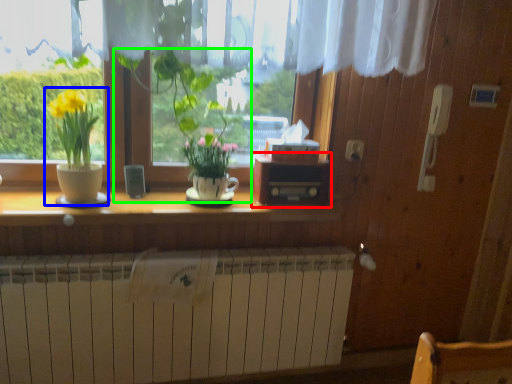
Question: Estimate the real-world distances between objects in this image. Which object is farther from window box (highlighted by a red box), houseplant (highlighted by a blue box) or houseplant (highlighted by a green box)?

Choices:
 (A) houseplant
 (B) houseplant

Answer: (A)